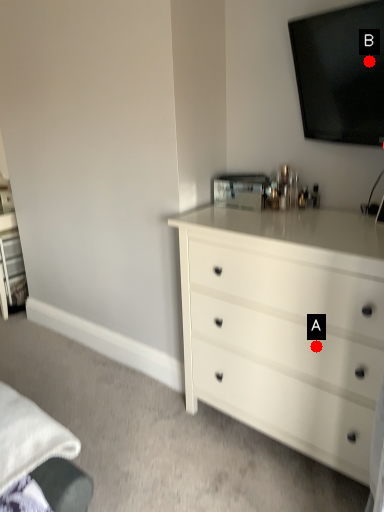
Question: Two points are circled on the image, labeled by A and B beside each circle. Which point is farther to the camera?

Choices:
 (A) A is further
 (B) B is further

Answer: (A)